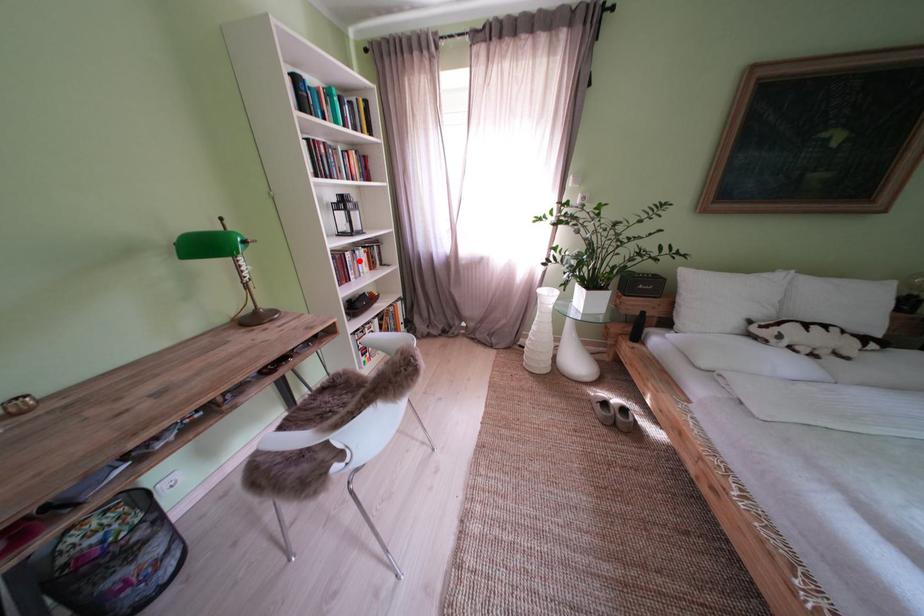
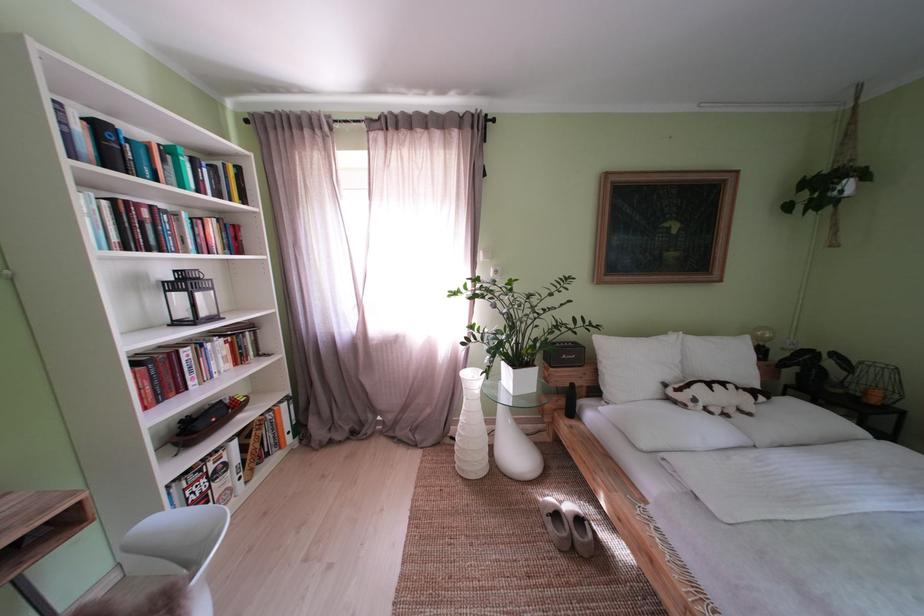
The point at the highlighted location is marked in the first image. Where is the corresponding point in the second image?

(199, 359)